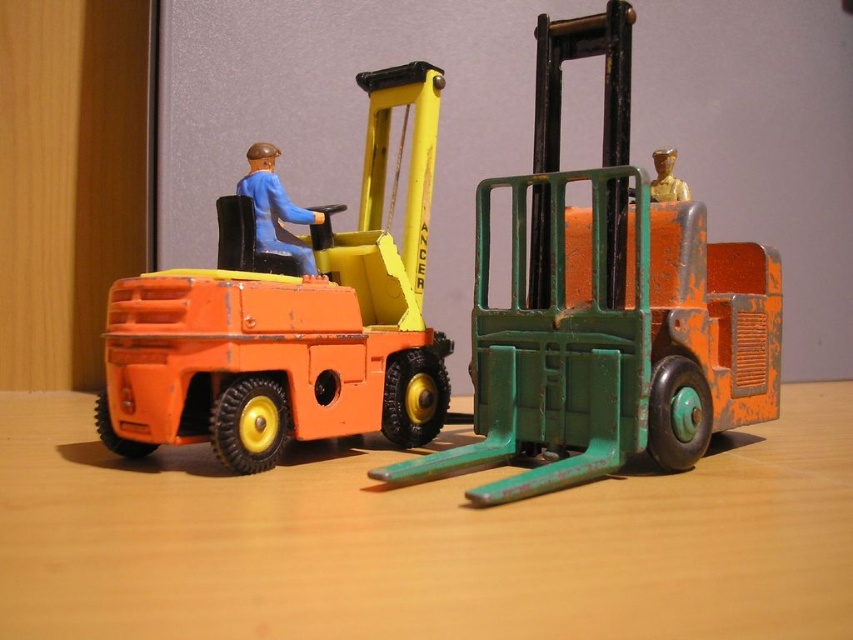
Measure the distance between orange matte forklift at left and gold metallic figure at center.

orange matte forklift at left is 16.57 inches from gold metallic figure at center.

Is orange matte forklift at left wider than gold metallic figure at center?

Yes.

Which is behind, point (378, 108) or point (676, 179)?

The point (378, 108) is behind.

Identify the location of orange matte forklift at left. (288, 323).

Who is positioned more to the left, green matte forklift at right or gold metallic figure at center?

From the viewer's perspective, green matte forklift at right appears more on the left side.

Does green matte forklift at right have a lesser height compared to gold metallic figure at center?

In fact, green matte forklift at right may be taller than gold metallic figure at center.

Image resolution: width=853 pixels, height=640 pixels. What do you see at coordinates (607, 307) in the screenshot?
I see `green matte forklift at right` at bounding box center [607, 307].

Image resolution: width=853 pixels, height=640 pixels. Find the location of `green matte forklift at right`. green matte forklift at right is located at coordinates (607, 307).

Does matte blue figure at center appear on the left side of gold metallic figure at center?

Indeed, matte blue figure at center is positioned on the left side of gold metallic figure at center.

What are the coordinates of `matte blue figure at center` in the screenshot? It's located at (276, 209).

Between point (251, 177) and point (664, 150), which one is positioned in front?

Point (251, 177) is more forward.

Find the location of a particular element. This screenshot has height=640, width=853. matte blue figure at center is located at coordinates (276, 209).